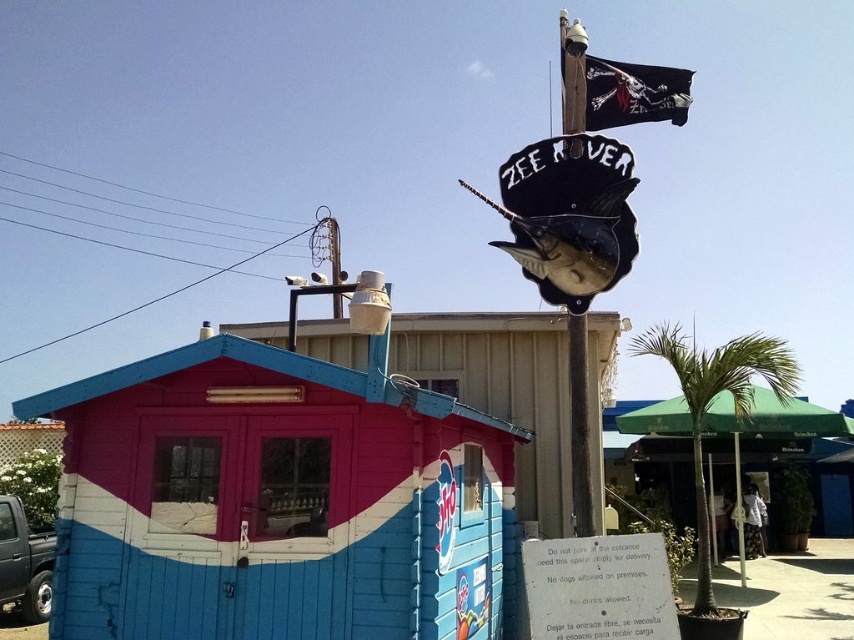
From the picture: Who is lower down, blue painted wood beach hut at lower left or green fabric umbrella at right?

green fabric umbrella at right is below.

Is point (352, 515) behind point (619, 403)?

No, (352, 515) is in front of (619, 403).

At what (x,y) coordinates should I click in order to perform the action: click on blue painted wood beach hut at lower left. Please return your answer as a coordinate pair (x, y). Looking at the image, I should click on (278, 500).

The image size is (854, 640). I want to click on blue painted wood beach hut at lower left, so click(x=278, y=500).